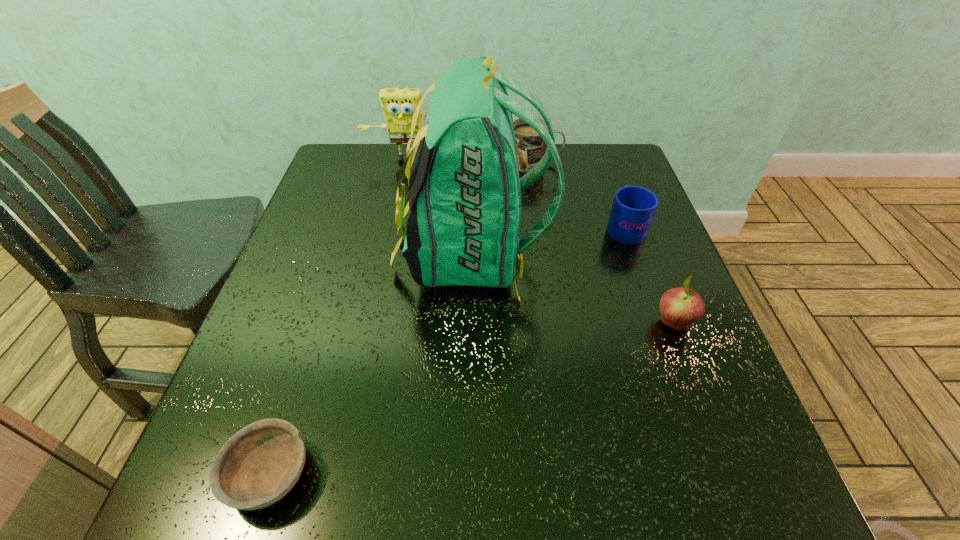
Where is `bowl present at the left edge`? bowl present at the left edge is located at coordinates (256, 467).

Where is `apple located in the right edge section of the desktop`? apple located in the right edge section of the desktop is located at coordinates (681, 306).

In order to click on mug located at the right edge in this screenshot , I will do `click(633, 208)`.

Identify the location of object that is positioned at the far left corner. (398, 105).

You are a GUI agent. You are given a task and a screenshot of the screen. Output one action in this format:
    pyautogui.click(x=<x>, y=<y>)
    Task: Click on the object at the near left corner
    The image size is (960, 540).
    Given the screenshot: What is the action you would take?
    point(256,467)

In the image, there is a desktop. Identify the location of vacant space at the near edge. This screenshot has width=960, height=540. (384, 514).

This screenshot has height=540, width=960. I want to click on vacant space at the left edge, so click(x=334, y=196).

You are a GUI agent. You are given a task and a screenshot of the screen. Output one action in this format:
    pyautogui.click(x=<x>, y=<y>)
    Task: Click on the blank space at the right edge of the desktop
    
    Given the screenshot: What is the action you would take?
    pyautogui.click(x=646, y=357)

Where is `free space at the far left corner of the desktop`? This screenshot has height=540, width=960. free space at the far left corner of the desktop is located at coordinates (382, 170).

Where is `vacant space at the far right corner of the desktop`? The width and height of the screenshot is (960, 540). vacant space at the far right corner of the desktop is located at coordinates (570, 144).